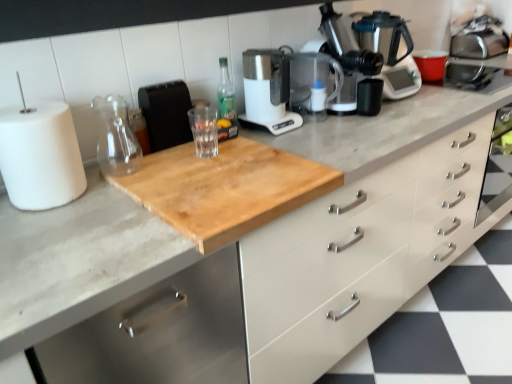
This screenshot has height=384, width=512. In order to click on unoccupied area in front of transparent glass jar at upper center, the 1th glass jar positioned from the left in this screenshot , I will do `click(106, 200)`.